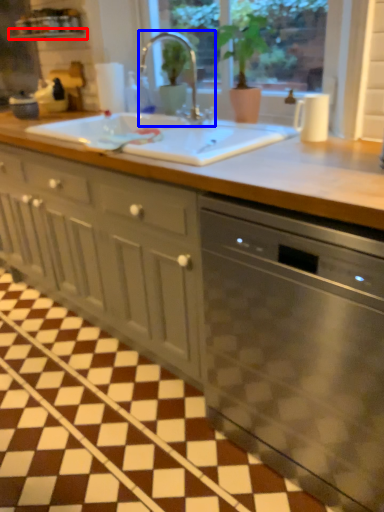
Question: Which object is closer to the camera taking this photo, window sill (highlighted by a red box) or tap (highlighted by a blue box)?

Choices:
 (A) window sill
 (B) tap

Answer: (B)